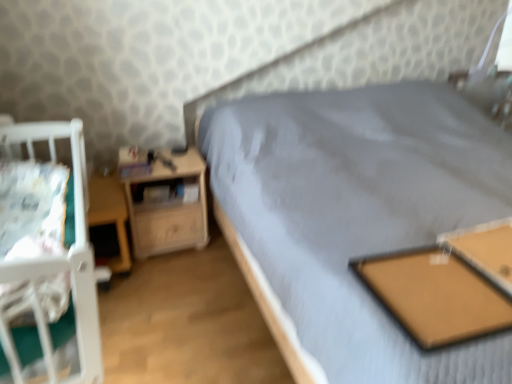
Question: Does white fabric sheet at left have a lesser width compared to wooden table at lower left, which is counted as the second table, starting from the right?

Choices:
 (A) yes
 (B) no

Answer: (A)

Question: From the image's perspective, is white fabric sheet at left on wooden table at lower left, which is counted as the first table, starting from the back?

Choices:
 (A) yes
 (B) no

Answer: (B)

Question: Does white fabric sheet at left have a larger size compared to wooden table at lower left, which is counted as the second table, starting from the right?

Choices:
 (A) no
 (B) yes

Answer: (A)

Question: Is white fabric sheet at left at the right side of wooden table at lower left, which is counted as the second table, starting from the right?

Choices:
 (A) yes
 (B) no

Answer: (A)

Question: Is white fabric sheet at left aimed at wooden table at lower left, which is counted as the second table, starting from the front?

Choices:
 (A) no
 (B) yes

Answer: (A)

Question: Is point (114, 218) closer or farther from the camera than point (81, 157)?

Choices:
 (A) closer
 (B) farther

Answer: (B)

Question: Is wooden table at lower left, which is counted as the second table, starting from the right, bigger or smaller than white fabric infant bed at left?

Choices:
 (A) small
 (B) big

Answer: (A)

Question: Considering the relative positions of wooden table at lower left, marked as the 1th table in a left-to-right arrangement, and white fabric infant bed at left in the image provided, is wooden table at lower left, marked as the 1th table in a left-to-right arrangement, to the left or to the right of white fabric infant bed at left?

Choices:
 (A) right
 (B) left

Answer: (B)

Question: In the image, is wooden table at lower left, marked as the 1th table in a left-to-right arrangement, positioned in front of or behind white fabric infant bed at left?

Choices:
 (A) behind
 (B) front

Answer: (A)

Question: Is point (80, 284) closer or farther from the camera than point (501, 324)?

Choices:
 (A) farther
 (B) closer

Answer: (B)

Question: Is white fabric infant bed at left taller or shorter than brown cork board at center, marked as the second table in a back-to-front arrangement?

Choices:
 (A) short
 (B) tall

Answer: (B)

Question: From the image's perspective, is white fabric infant bed at left located above or below brown cork board at center, the second table when ordered from left to right?

Choices:
 (A) above
 (B) below

Answer: (A)

Question: Based on their positions, is white fabric infant bed at left located to the left or right of brown cork board at center, which appears as the first table when viewed from the right?

Choices:
 (A) right
 (B) left

Answer: (B)

Question: Considering the positions of wooden nightstand at left and brown cork board at center, which appears as the first table when viewed from the right, in the image, is wooden nightstand at left taller or shorter than brown cork board at center, which appears as the first table when viewed from the right,?

Choices:
 (A) short
 (B) tall

Answer: (B)

Question: Do you think wooden nightstand at left is within brown cork board at center, marked as the second table in a back-to-front arrangement, or outside of it?

Choices:
 (A) inside
 (B) outside

Answer: (B)